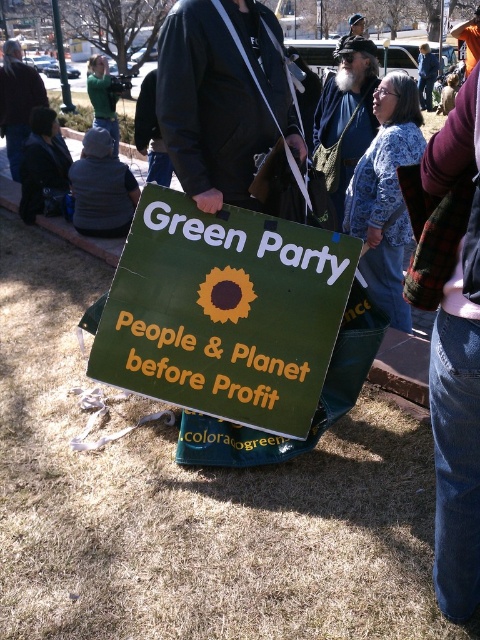
You are organizing a protest and need to decide which item to prioritize carrying based on their size. Given that you have the green cardboard sign at center and the gray fleece jacket at left, which item takes up more space horizontally?

The green cardboard sign at center is wider than the gray fleece jacket at left, so it takes up more horizontal space.

You are a photographer at the event and want to capture a photo of the black leather jacket at center and the bearded man with hat at upper center in the same frame. Based on their positions, can you fit both subjects into the camera viewfinder without moving the camera?

The black leather jacket at center might be wider than bearded man with hat at upper center, so it depends on the camera angle and how much space they occupy horizontally. If the jacket is wider, it could block part of the man unless the camera is positioned to include both.